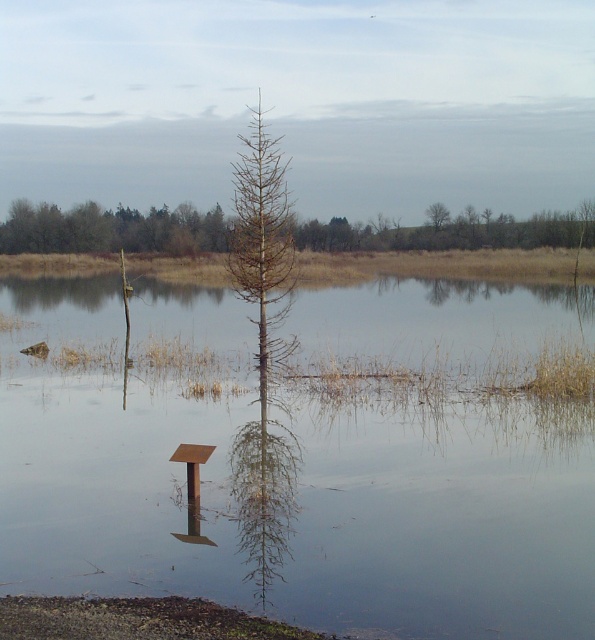
You are standing at the point marked by the coordinates point (x=111, y=228). Looking around, you see a small rusted metal structure partially submerged in the water and a tree in the middle of the water. Which object is closer to your current position?

The brown wood tree at upper center is closer to your current position marked by point (x=111, y=228), as the point marks the location of the tree.